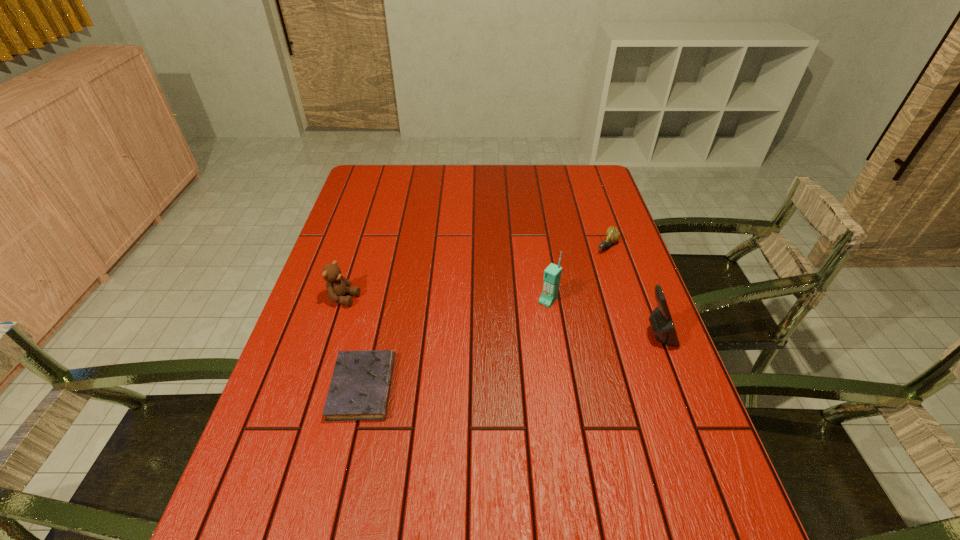
You are a GUI agent. You are given a task and a screenshot of the screen. Output one action in this format:
    pyautogui.click(x=<x>, y=<y>)
    Task: Click on the teddy bear that is at the left edge
    The width and height of the screenshot is (960, 540).
    Given the screenshot: What is the action you would take?
    pyautogui.click(x=337, y=286)

At what (x,y) coordinates should I click in order to perform the action: click on cellular telephone that is positioned at the right edge. Please return your answer as a coordinate pair (x, y). Looking at the image, I should click on (660, 319).

This screenshot has height=540, width=960. I want to click on escargot that is at the right edge, so click(612, 234).

In the image, there is a desktop. Where is `free space at the far edge`? This screenshot has height=540, width=960. free space at the far edge is located at coordinates (462, 168).

Locate an element on the screen. blank space at the near edge is located at coordinates (588, 483).

This screenshot has height=540, width=960. What are the coordinates of `vacant space at the left edge` in the screenshot? It's located at (297, 370).

In the image, there is a desktop. At what (x,y) coordinates should I click in order to perform the action: click on vacant space at the right edge. Please return your answer as a coordinate pair (x, y). This screenshot has height=540, width=960. Looking at the image, I should click on (666, 406).

I want to click on vacant point at the far right corner, so click(x=573, y=166).

The height and width of the screenshot is (540, 960). I want to click on vacant space at the near right corner of the desktop, so click(690, 480).

Identify the location of free point between the left cellular telephone and the teddy bear. (446, 299).